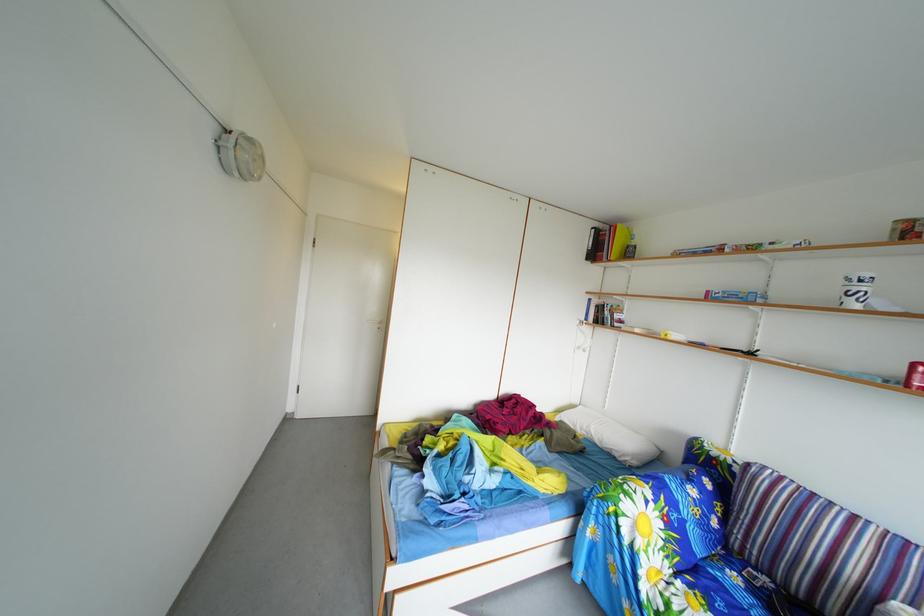
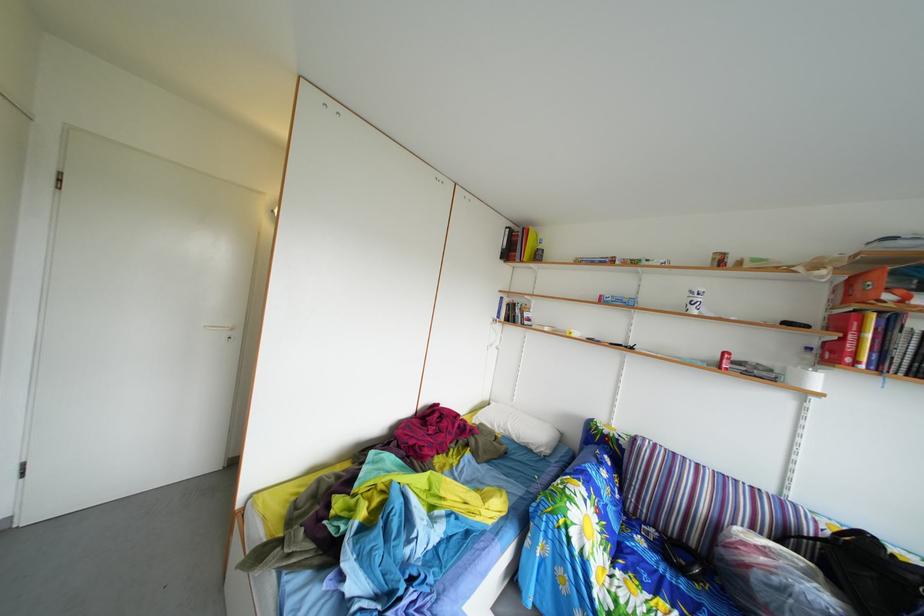
Question: Based on the continuous images, in which direction is the camera rotating? Reply with the corresponding letter.

Choices:
 (A) Left
 (B) Right
 (C) Up
 (D) Down

Answer: (B)